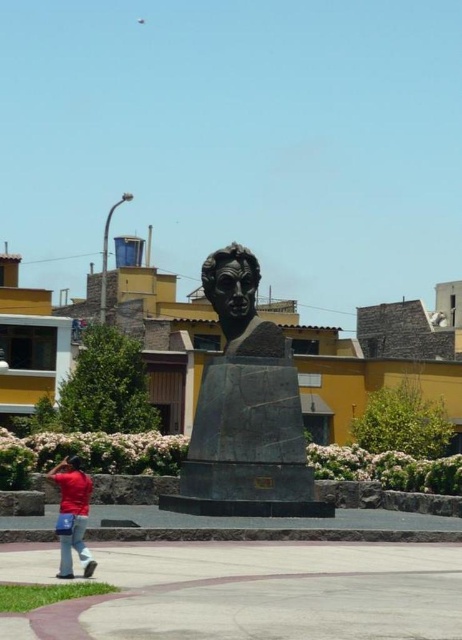
You are a tourist standing at the entrance of the square and want to take a photo of the black polished stone bust at center without the matte red shirt at lower left appearing in the frame. Is it possible to do so given their sizes?

The black polished stone bust at center is narrower than the matte red shirt at lower left. Therefore, you can position yourself so that the bust fits within the frame while excluding the shirt by adjusting your angle or distance, as the bust is smaller in width.

You are standing in the public square and want to take a photo of the statue. You notice two points marked in the scene. One is at coordinates point (269, 323) and the other is at point (55, 529). Which point is closer to your current position?

Point (269, 323) is closer to your current position because it is further to the camera than point (55, 529), meaning it is nearer to the observer.